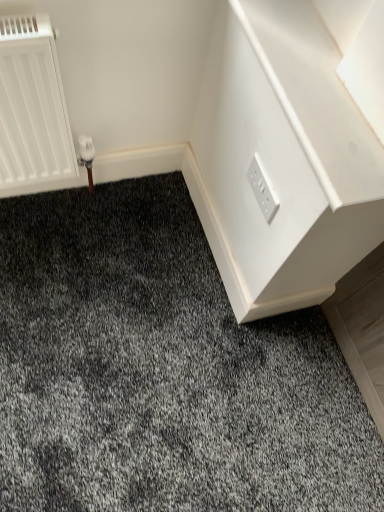
Question: Would you say white glossy dresser at upper right is a long distance from white plastic power plugs and sockets at upper right?

Choices:
 (A) yes
 (B) no

Answer: (B)

Question: From a real-world perspective, is white glossy dresser at upper right below white plastic power plugs and sockets at upper right?

Choices:
 (A) yes
 (B) no

Answer: (B)

Question: Is the position of white glossy dresser at upper right more distant than that of white plastic power plugs and sockets at upper right?

Choices:
 (A) no
 (B) yes

Answer: (A)

Question: Can you confirm if white glossy dresser at upper right is smaller than white plastic power plugs and sockets at upper right?

Choices:
 (A) yes
 (B) no

Answer: (B)

Question: Is white glossy dresser at upper right facing away from white plastic power plugs and sockets at upper right?

Choices:
 (A) no
 (B) yes

Answer: (A)

Question: From the image's perspective, would you say white glossy dresser at upper right is shown under white plastic power plugs and sockets at upper right?

Choices:
 (A) yes
 (B) no

Answer: (B)

Question: From the image's perspective, would you say white plastic power plugs and sockets at upper right is shown under white glossy dresser at upper right?

Choices:
 (A) no
 (B) yes

Answer: (B)

Question: Can you confirm if white plastic power plugs and sockets at upper right is positioned to the left of white glossy dresser at upper right?

Choices:
 (A) yes
 (B) no

Answer: (A)

Question: Can you confirm if white plastic power plugs and sockets at upper right is smaller than white glossy dresser at upper right?

Choices:
 (A) no
 (B) yes

Answer: (B)

Question: Can you see white plastic power plugs and sockets at upper right touching white glossy dresser at upper right?

Choices:
 (A) no
 (B) yes

Answer: (A)

Question: From the image's perspective, would you say white plastic power plugs and sockets at upper right is positioned over white glossy dresser at upper right?

Choices:
 (A) yes
 (B) no

Answer: (B)

Question: Is white plastic power plugs and sockets at upper right located outside white glossy dresser at upper right?

Choices:
 (A) yes
 (B) no

Answer: (A)

Question: In the image, is white glossy dresser at upper right on the left side or the right side of white plastic power plugs and sockets at upper right?

Choices:
 (A) right
 (B) left

Answer: (A)